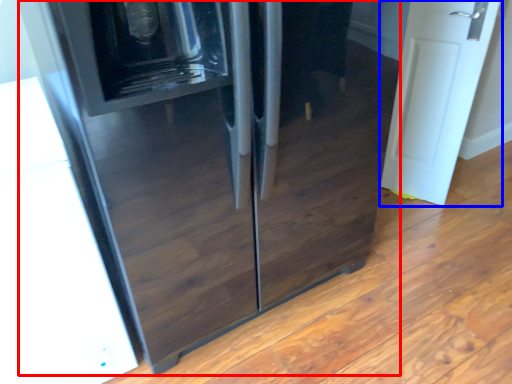
Question: Which of the following is the closest to the observer, refrigerator (highlighted by a red box) or door (highlighted by a blue box)?

Choices:
 (A) refrigerator
 (B) door

Answer: (A)